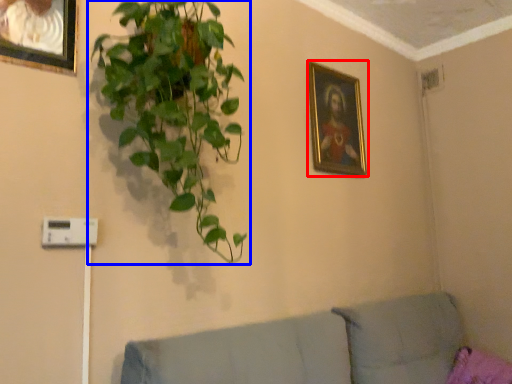
Question: Among these objects, which one is nearest to the camera, picture frame (highlighted by a red box) or houseplant (highlighted by a blue box)?

Choices:
 (A) picture frame
 (B) houseplant

Answer: (B)